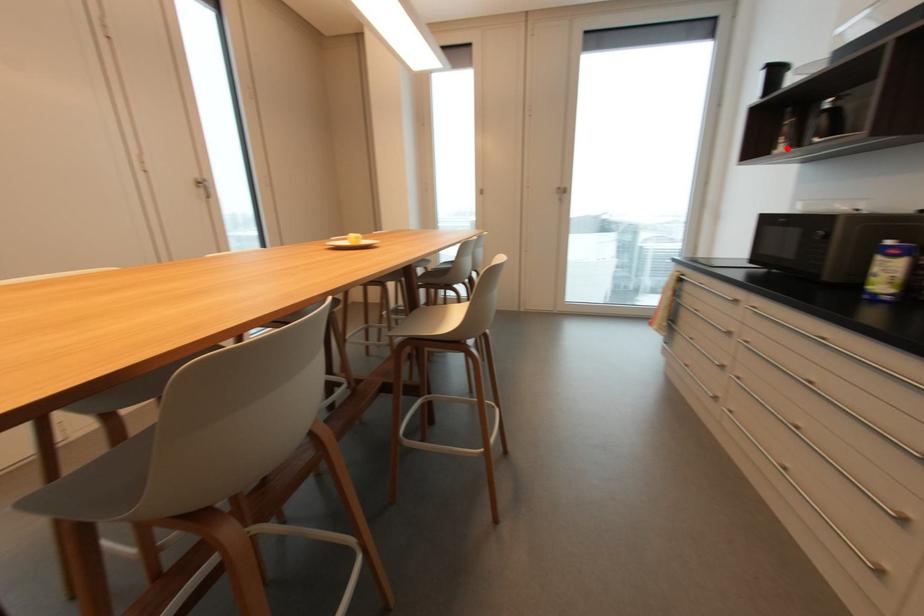
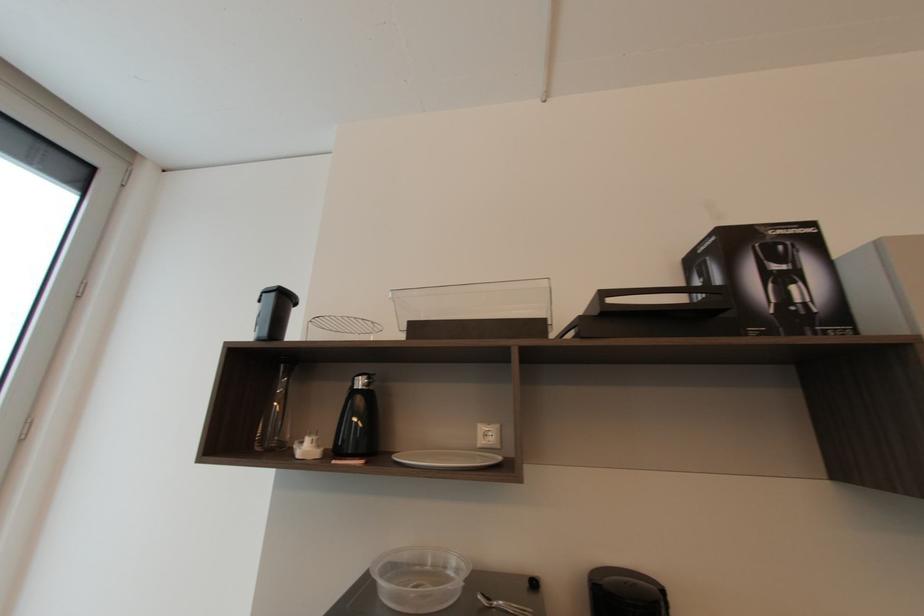
Locate, in the second image, the point that corresponds to the highlighted location in the first image.

(310, 447)